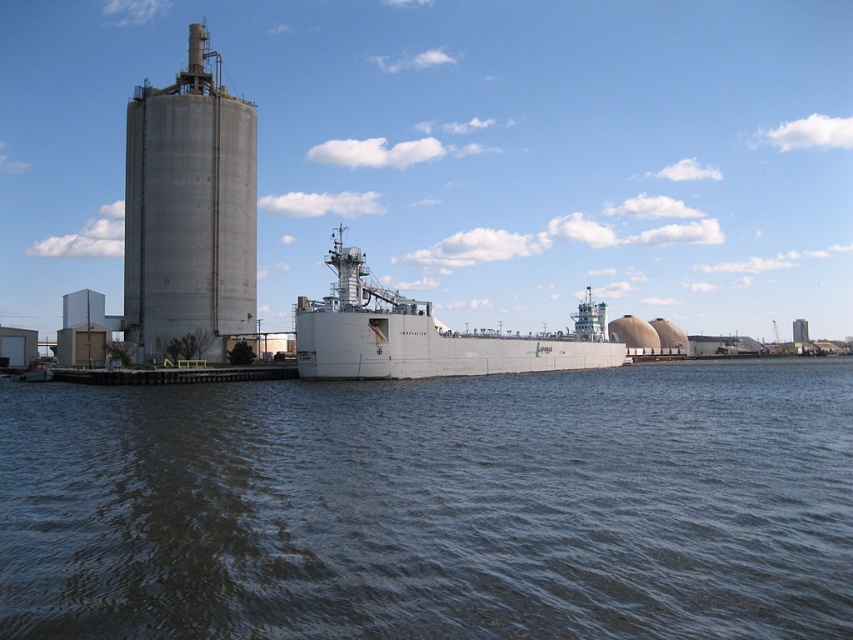
Is dark blue water at center below concrete silo at left?

Indeed, dark blue water at center is positioned under concrete silo at left.

Does dark blue water at center have a lesser width compared to concrete silo at left?

In fact, dark blue water at center might be wider than concrete silo at left.

Describe the element at coordinates (434, 506) in the screenshot. The width and height of the screenshot is (853, 640). I see `dark blue water at center` at that location.

Identify the location of dark blue water at center. (434, 506).

Does dark blue water at center lie behind white matte ship at center?

No.

Which is in front, point (438, 493) or point (323, 356)?

Point (438, 493) is in front.

Locate an element on the screen. dark blue water at center is located at coordinates (434, 506).

Between concrete silo at left and white matte ship at center, which one has more height?

With more height is concrete silo at left.

Who is shorter, concrete silo at left or white matte ship at center?

With less height is white matte ship at center.

Is point (148, 276) behind point (397, 355)?

Yes, it is behind point (397, 355).

Locate an element on the screen. The height and width of the screenshot is (640, 853). concrete silo at left is located at coordinates (189, 209).